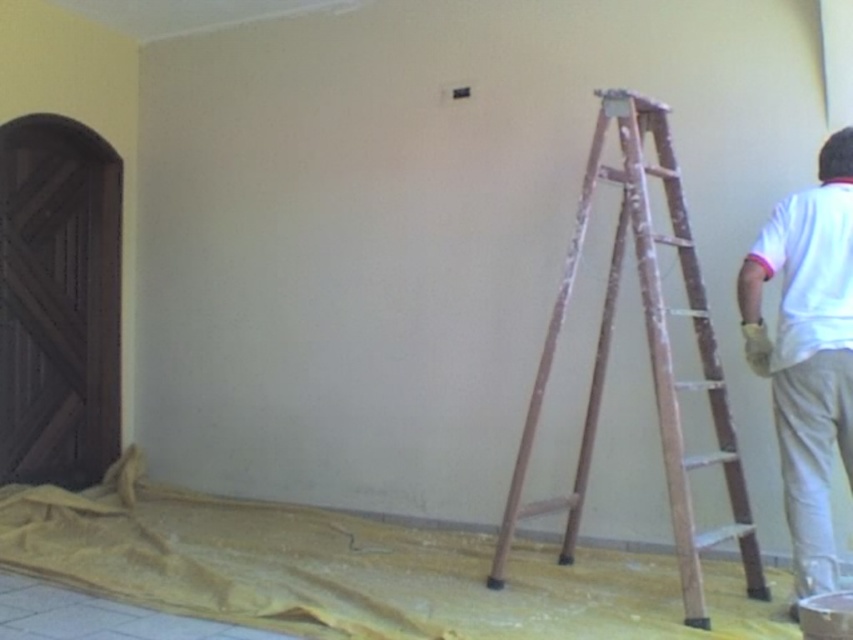
Is point (848, 470) farther from viewer compared to point (825, 305)?

Yes, point (848, 470) is farther from viewer.

Does point (801, 276) come behind point (788, 262)?

No, (801, 276) is in front of (788, 262).

Locate an element on the screen. The width and height of the screenshot is (853, 640). white cotton shirt at right is located at coordinates (807, 349).

Is wooden ladder at right positioned behind white matte shirt at right?

No, wooden ladder at right is closer to the viewer.

Is point (549, 369) less distant than point (756, 236)?

That is True.

Where is `wooden ladder at right`? Image resolution: width=853 pixels, height=640 pixels. wooden ladder at right is located at coordinates (648, 356).

Which is above, dark wood barn door at left or white matte shirt at right?

white matte shirt at right is higher up.

Does dark wood barn door at left have a larger size compared to white matte shirt at right?

Yes, dark wood barn door at left is bigger than white matte shirt at right.

Which is behind, point (41, 454) or point (830, 236)?

Positioned behind is point (41, 454).

Identify the location of dark wood barn door at left. (57, 301).